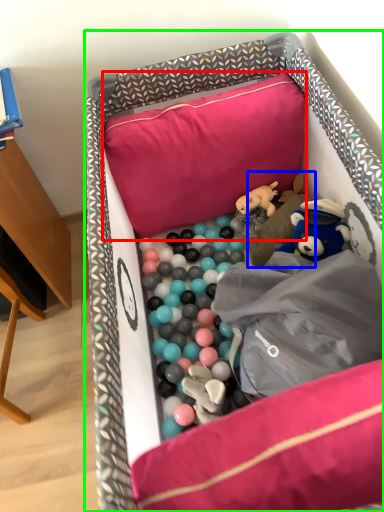
Question: Considering the real-world distances, which object is farthest from pillow (highlighted by a red box)? toy (highlighted by a blue box) or infant bed (highlighted by a green box)?

Choices:
 (A) toy
 (B) infant bed

Answer: (A)